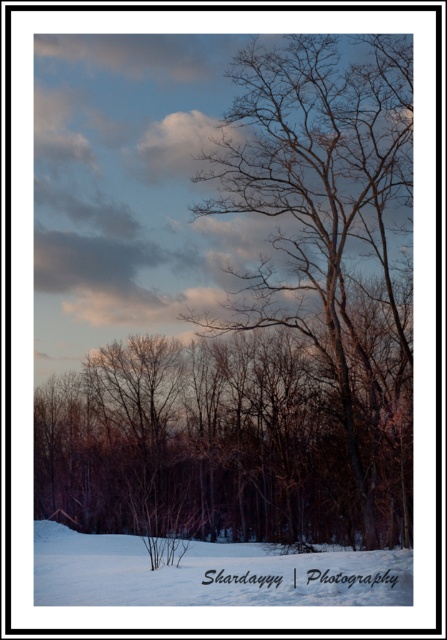
In the scene shown: Can you confirm if bare branches at center is positioned below white powdery snow at lower left?

No, bare branches at center is not below white powdery snow at lower left.

Who is more forward, (286, 298) or (88, 600)?

Point (88, 600) is more forward.

Image resolution: width=447 pixels, height=640 pixels. I want to click on bare branches at center, so click(x=324, y=224).